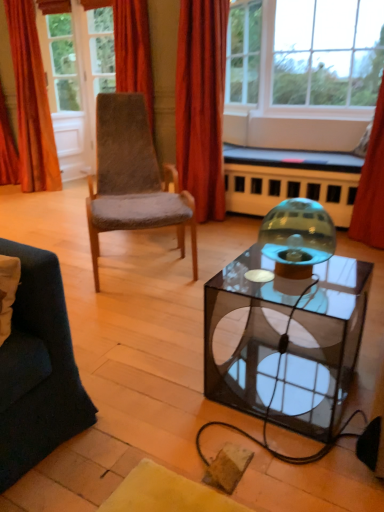
I want to click on brown fuzzy chair at center, so click(x=132, y=178).

The height and width of the screenshot is (512, 384). Describe the element at coordinates (304, 54) in the screenshot. I see `transparent glass window at upper center, which is the first window from right to left` at that location.

What is the approximate height of transparent glass table at center?

The height of transparent glass table at center is 18.73 inches.

At what (x,y) coordinates should I click in order to perform the action: click on red velvet curtain at center, positioned as the 3th curtain in left-to-right order. Please return your answer as a coordinate pair (x, y). This screenshot has width=384, height=512. Looking at the image, I should click on (201, 104).

The height and width of the screenshot is (512, 384). Identify the location of glass door lying on the left of transparent glass table at center. (76, 80).

Based on the photo, which is more to the left, transparent glass door at upper left or transparent glass table at center?

From the viewer's perspective, transparent glass door at upper left appears more on the left side.

Between transparent glass door at upper left and transparent glass table at center, which one is positioned behind?

transparent glass door at upper left is behind.

In terms of size, does brown fuzzy chair at center appear bigger or smaller than red velvet curtain at center, positioned as the 3th curtain in left-to-right order?

In the image, brown fuzzy chair at center appears to be larger than red velvet curtain at center, positioned as the 3th curtain in left-to-right order.

Could you tell me if brown fuzzy chair at center is facing red velvet curtain at center, acting as the 1th curtain starting from the right?

No, brown fuzzy chair at center is not oriented towards red velvet curtain at center, acting as the 1th curtain starting from the right.

Is brown fuzzy chair at center wider than red velvet curtain at center, positioned as the 3th curtain in left-to-right order?

Yes, brown fuzzy chair at center is wider than red velvet curtain at center, positioned as the 3th curtain in left-to-right order.

Is brown fuzzy chair at center far away from red velvet curtain at center, positioned as the 3th curtain in left-to-right order?

Actually, brown fuzzy chair at center and red velvet curtain at center, positioned as the 3th curtain in left-to-right order, are a little close together.

Measure the distance from transparent glass window at upper center, the 2th window viewed from the left, to clear glass window at upper center, which is the first window in left-to-right order.

transparent glass window at upper center, the 2th window viewed from the left, is 34.53 inches away from clear glass window at upper center, which is the first window in left-to-right order.

Considering the points (274, 59) and (250, 55), which point is in front, point (274, 59) or point (250, 55)?

The point (274, 59) is closer to the camera.

From the image's perspective, is transparent glass window at upper center, the 2th window viewed from the left, over clear glass window at upper center, which is the first window in left-to-right order?

No, from the image's perspective, transparent glass window at upper center, the 2th window viewed from the left, is not over clear glass window at upper center, which is the first window in left-to-right order.

Does transparent glass window at upper center, the 2th window viewed from the left, have a larger size compared to clear glass window at upper center, which is the first window in left-to-right order?

Yes.

From the image's perspective, which one is positioned lower, brown fuzzy chair at center or red velvet curtain at upper center, which is the second curtain in right-to-left order?

brown fuzzy chair at center is shown below in the image.

Is brown fuzzy chair at center taller than red velvet curtain at upper center, which is the second curtain in right-to-left order?

Indeed, brown fuzzy chair at center has a greater height compared to red velvet curtain at upper center, which is the second curtain in right-to-left order.

Considering the sizes of objects brown fuzzy chair at center and red velvet curtain at upper center, which is the second curtain in right-to-left order, in the image provided, who is thinner, brown fuzzy chair at center or red velvet curtain at upper center, which is the second curtain in right-to-left order,?

With smaller width is red velvet curtain at upper center, which is the second curtain in right-to-left order.

Can you confirm if transparent glass door at upper left is shorter than orange velvet curtain at upper left, the 1th curtain in the left-to-right sequence?

No.

From the picture: Measure the distance between transparent glass door at upper left and orange velvet curtain at upper left, the 1th curtain in the left-to-right sequence.

transparent glass door at upper left and orange velvet curtain at upper left, the 1th curtain in the left-to-right sequence, are 46.22 centimeters apart.

Based on the photo, who is more distant, transparent glass door at upper left or orange velvet curtain at upper left, which is the 3th curtain in right-to-left order?

transparent glass door at upper left is more distant.

At what (x,y) coordinates should I click in order to perform the action: click on glass door on the left of clear glass window at upper center, which is the first window in left-to-right order. Please return your answer as a coordinate pair (x, y). The height and width of the screenshot is (512, 384). Looking at the image, I should click on (76, 80).

Based on the photo, how distant is clear glass window at upper center, which ranks as the 2th window in right-to-left order, from transparent glass door at upper left?

clear glass window at upper center, which ranks as the 2th window in right-to-left order, and transparent glass door at upper left are 5.38 feet apart.

Considering the sizes of objects clear glass window at upper center, which is the first window in left-to-right order, and transparent glass door at upper left in the image provided, who is bigger, clear glass window at upper center, which is the first window in left-to-right order, or transparent glass door at upper left?

transparent glass door at upper left.

From the image's perspective, is red velvet curtain at upper center, which is the second curtain in right-to-left order, above transparent glass candle holder at center?

Yes, from the image's perspective, red velvet curtain at upper center, which is the second curtain in right-to-left order, is on top of transparent glass candle holder at center.

Looking at their sizes, would you say red velvet curtain at upper center, which is counted as the second curtain, starting from the left, is wider or thinner than transparent glass candle holder at center?

In the image, red velvet curtain at upper center, which is counted as the second curtain, starting from the left, appears to be more narrow than transparent glass candle holder at center.

From a real-world perspective, which is physically below, red velvet curtain at upper center, which is counted as the second curtain, starting from the left, or transparent glass candle holder at center?

In real-world perspective, transparent glass candle holder at center is lower.

Is red velvet curtain at upper center, which is the second curtain in right-to-left order, not near transparent glass candle holder at center?

Yes.

This screenshot has width=384, height=512. Find the location of `table on the right of transparent glass door at upper left`. table on the right of transparent glass door at upper left is located at coordinates (322, 349).

You are a GUI agent. You are given a task and a screenshot of the screen. Output one action in this format:
    pyautogui.click(x=<x>, y=<y>)
    Task: Click on the chair below the red velvet curtain at center, positioned as the 3th curtain in left-to-right order (from a real-world perspective)
    The width and height of the screenshot is (384, 512).
    Given the screenshot: What is the action you would take?
    pyautogui.click(x=132, y=178)

From the image, which object appears to be nearer to red velvet curtain at upper center, which is counted as the second curtain, starting from the left, red velvet curtain at center, acting as the 1th curtain starting from the right, or transparent glass window at upper center, which is the first window from right to left?

red velvet curtain at center, acting as the 1th curtain starting from the right, is positioned closer to the anchor red velvet curtain at upper center, which is counted as the second curtain, starting from the left.

When comparing their distances from clear glass window at upper center, which ranks as the 2th window in right-to-left order, does transparent glass table at center or red velvet curtain at upper center, which is counted as the second curtain, starting from the left, seem closer?

red velvet curtain at upper center, which is counted as the second curtain, starting from the left, is closer to clear glass window at upper center, which ranks as the 2th window in right-to-left order.

Considering their positions, is transparent glass candle holder at center positioned closer to brown fuzzy chair at center than matte black couch at center?

matte black couch at center.

When comparing their distances from transparent glass candle holder at center, does transparent glass window at upper center, which is the first window from right to left, or red velvet curtain at upper center, which is counted as the second curtain, starting from the left, seem further?

transparent glass window at upper center, which is the first window from right to left.

Based on their spatial positions, is orange velvet curtain at upper left, which is the 3th curtain in right-to-left order, or matte black couch at center further from clear glass window at upper center, which ranks as the 2th window in right-to-left order?

orange velvet curtain at upper left, which is the 3th curtain in right-to-left order, is positioned further to the anchor clear glass window at upper center, which ranks as the 2th window in right-to-left order.

Estimate the real-world distances between objects in this image. Which object is closer to transparent glass table at center, transparent glass door at upper left or orange velvet curtain at upper left, which is the 3th curtain in right-to-left order?

orange velvet curtain at upper left, which is the 3th curtain in right-to-left order.

When comparing their distances from matte black couch at center, does red velvet curtain at upper center, which is counted as the second curtain, starting from the left, or brown fuzzy chair at center seem further?

The object further to matte black couch at center is red velvet curtain at upper center, which is counted as the second curtain, starting from the left.

Estimate the real-world distances between objects in this image. Which object is further from red velvet curtain at center, acting as the 1th curtain starting from the right, transparent glass door at upper left or orange velvet curtain at upper left, which is the 3th curtain in right-to-left order?

transparent glass door at upper left is positioned further to the anchor red velvet curtain at center, acting as the 1th curtain starting from the right.

Where is `window between brown fuzzy chair at center and matte black couch at center in the horizontal direction`? The height and width of the screenshot is (512, 384). window between brown fuzzy chair at center and matte black couch at center in the horizontal direction is located at coordinates (243, 53).

At what (x,y) coordinates should I click in order to perform the action: click on window between transparent glass door at upper left and transparent glass window at upper center, the 2th window viewed from the left. Please return your answer as a coordinate pair (x, y). This screenshot has height=512, width=384. Looking at the image, I should click on (243, 53).

At what (x,y) coordinates should I click in order to perform the action: click on chair located between transparent glass candle holder at center and red velvet curtain at center, acting as the 1th curtain starting from the right, in the depth direction. Please return your answer as a coordinate pair (x, y). Looking at the image, I should click on (132, 178).

You are a GUI agent. You are given a task and a screenshot of the screen. Output one action in this format:
    pyautogui.click(x=<x>, y=<y>)
    Task: Click on the curtain between red velvet curtain at upper center, which is the second curtain in right-to-left order, and transparent glass window at upper center, which is the first window from right to left, from left to right
    
    Given the screenshot: What is the action you would take?
    pyautogui.click(x=201, y=104)